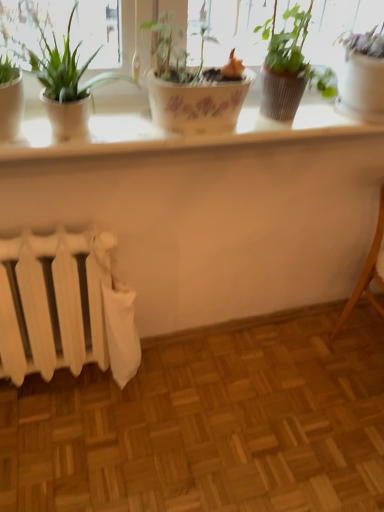
Question: Is green matte pot at upper center, the 3th houseplant viewed from the left, shorter than light brown wooden chair at lower right?

Choices:
 (A) no
 (B) yes

Answer: (B)

Question: Is green matte pot at upper center, which is counted as the second houseplant, starting from the right, oriented towards light brown wooden chair at lower right?

Choices:
 (A) yes
 (B) no

Answer: (B)

Question: From a real-world perspective, does green matte pot at upper center, the 3th houseplant viewed from the left, sit lower than light brown wooden chair at lower right?

Choices:
 (A) no
 (B) yes

Answer: (A)

Question: Can you confirm if green matte pot at upper center, the 3th houseplant viewed from the left, is bigger than light brown wooden chair at lower right?

Choices:
 (A) yes
 (B) no

Answer: (B)

Question: Is green matte pot at upper center, which is counted as the second houseplant, starting from the right, far away from light brown wooden chair at lower right?

Choices:
 (A) no
 (B) yes

Answer: (A)

Question: In the image, is white glossy pot at upper right, marked as the first houseplant in a right-to-left arrangement, on the left side or the right side of white matte radiator at lower left?

Choices:
 (A) left
 (B) right

Answer: (B)

Question: From the image's perspective, relative to white matte radiator at lower left, is white glossy pot at upper right, the fourth houseplant when ordered from left to right, above or below?

Choices:
 (A) above
 (B) below

Answer: (A)

Question: In terms of width, does white glossy pot at upper right, marked as the first houseplant in a right-to-left arrangement, look wider or thinner when compared to white matte radiator at lower left?

Choices:
 (A) wide
 (B) thin

Answer: (A)

Question: From a real-world perspective, is white glossy pot at upper right, the fourth houseplant when ordered from left to right, above or below white matte radiator at lower left?

Choices:
 (A) below
 (B) above

Answer: (B)

Question: From a real-world perspective, is white glossy counter top at upper center positioned above or below green glossy plant at left, the 4th houseplant from the right?

Choices:
 (A) below
 (B) above

Answer: (A)

Question: Considering the relative positions of white glossy counter top at upper center and green glossy plant at left, marked as the first houseplant in a left-to-right arrangement, in the image provided, is white glossy counter top at upper center to the left or to the right of green glossy plant at left, marked as the first houseplant in a left-to-right arrangement,?

Choices:
 (A) right
 (B) left

Answer: (A)

Question: Relative to green glossy plant at left, marked as the first houseplant in a left-to-right arrangement, is white glossy counter top at upper center in front or behind?

Choices:
 (A) behind
 (B) front

Answer: (A)

Question: From the image's perspective, is white glossy counter top at upper center positioned above or below green glossy plant at left, the 4th houseplant from the right?

Choices:
 (A) above
 (B) below

Answer: (B)

Question: From a real-world perspective, is white glossy pot at upper right, marked as the first houseplant in a right-to-left arrangement, above or below green glossy plant at left, the 4th houseplant from the right?

Choices:
 (A) below
 (B) above

Answer: (B)

Question: Is white glossy pot at upper right, marked as the first houseplant in a right-to-left arrangement, bigger or smaller than green glossy plant at left, marked as the first houseplant in a left-to-right arrangement?

Choices:
 (A) small
 (B) big

Answer: (B)